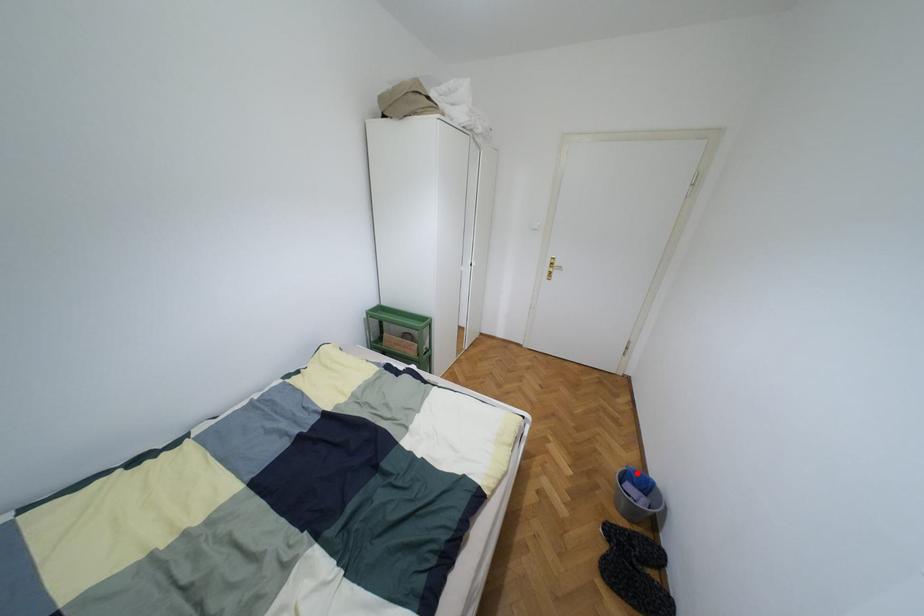
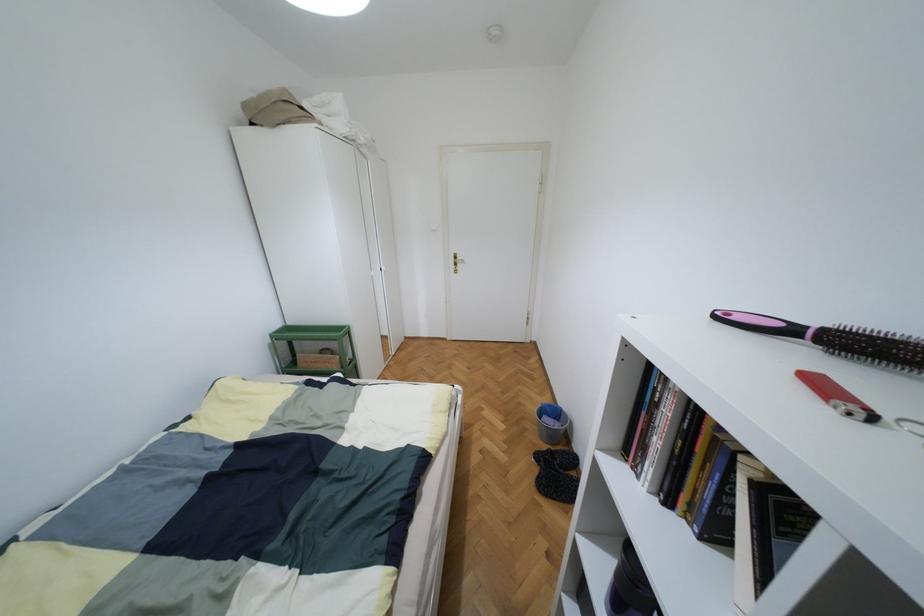
Question: I am providing you with two images of the same scene from different viewpoints. Image1 has a red point marked. In image2, the corresponding 3D location appears at what relative position? Reply with the corresponding letter.

Choices:
 (A) Closer
 (B) Farther

Answer: (A)